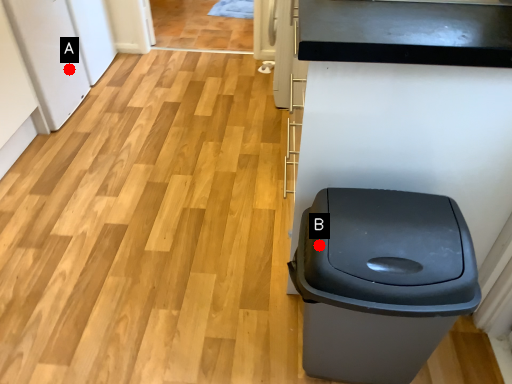
Question: Two points are circled on the image, labeled by A and B beside each circle. Among these points, which one is farthest from the camera?

Choices:
 (A) A is further
 (B) B is further

Answer: (A)